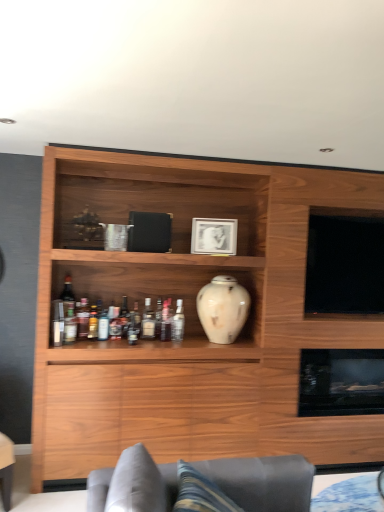
Question: Is white glossy vase at center inside or outside of translucent glass bottle at center, which ranks as the second bottle in left-to-right order?

Choices:
 (A) outside
 (B) inside

Answer: (A)

Question: From a real-world perspective, is white glossy vase at center physically located above or below translucent glass bottle at center, which appears as the 5th bottle when viewed from the right?

Choices:
 (A) below
 (B) above

Answer: (B)

Question: Which object is the farthest from the translucent glass bottle at center, which ranks as the second bottle in left-to-right order?

Choices:
 (A) wooden cabinet at center
 (B) translucent glass bottles at shelf center, the first bottle viewed from the left
 (C) translucent glass bottle at middle, the third bottle when ordered from left to right
 (D) clear glass bottle at center, which ranks as the 1th bottle in right-to-left order
 (E) black glass fireplace at lower right

Answer: (E)

Question: Based on their relative distances, which object is farther from the gray fabric couch at lower center?

Choices:
 (A) black glass fireplace at lower right
 (B) white glossy vase at center
 (C) clear glass bottle at center, which appears as the sixth bottle when viewed from the left
 (D) translucent glass bottle at middle, the 2th bottle viewed from the right
 (E) translucent glass bottle at middle, the third bottle when ordered from left to right

Answer: (A)